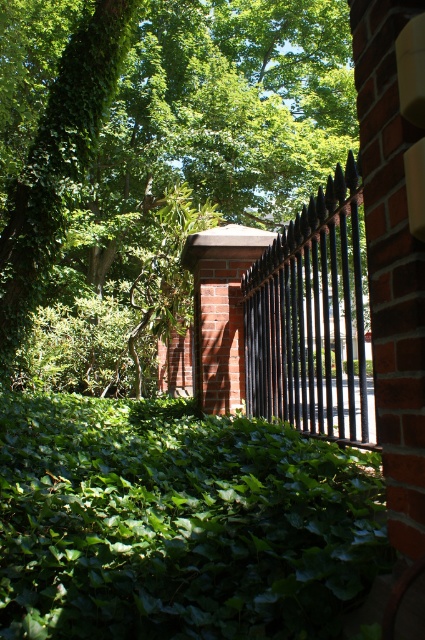
Question: Which of the following is the farthest from the observer?

Choices:
 (A) (132, 477)
 (B) (113, 12)

Answer: (B)

Question: Which is farther from the black metal fence at center?

Choices:
 (A) green leafy ivy at center
 (B) green leafy tree at upper left

Answer: (B)

Question: Which point appears farthest from the camera in this image?

Choices:
 (A) (362, 416)
 (B) (20, 333)

Answer: (B)

Question: Is green leafy ivy at center to the right of black metal fence at center from the viewer's perspective?

Choices:
 (A) yes
 (B) no

Answer: (B)

Question: Is green leafy tree at upper left bigger than black metal fence at center?

Choices:
 (A) no
 (B) yes

Answer: (B)

Question: Does green leafy tree at upper left have a smaller size compared to green leafy ivy at center?

Choices:
 (A) yes
 (B) no

Answer: (B)